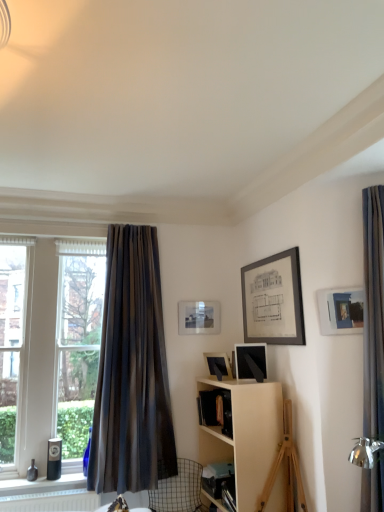
Question: Is dark gray textured curtain at left looking in the opposite direction of matte black picture frame at upper right, the second picture frame positioned from the right?

Choices:
 (A) no
 (B) yes

Answer: (A)

Question: Does dark gray textured curtain at left lie behind matte black picture frame at upper right, which ranks as the third picture frame in back-to-front order?

Choices:
 (A) yes
 (B) no

Answer: (A)

Question: Does dark gray textured curtain at left touch matte black picture frame at upper right, the second picture frame positioned from the right?

Choices:
 (A) no
 (B) yes

Answer: (A)

Question: Is dark gray textured curtain at left thinner than matte black picture frame at upper right, the second picture frame positioned from the right?

Choices:
 (A) no
 (B) yes

Answer: (A)

Question: From the image's perspective, is dark gray textured curtain at left under matte black picture frame at upper right, the 3th picture frame in the left-to-right sequence?

Choices:
 (A) no
 (B) yes

Answer: (A)

Question: Does dark gray textured curtain at left contain matte black picture frame at upper right, the second picture frame positioned from the right?

Choices:
 (A) yes
 (B) no

Answer: (B)

Question: Can you confirm if matte black picture frame at center, marked as the third picture frame in a right-to-left arrangement, is smaller than clear glass window at left?

Choices:
 (A) no
 (B) yes

Answer: (B)

Question: Does matte black picture frame at center, which is counted as the third picture frame, starting from the front, have a greater width compared to clear glass window at left?

Choices:
 (A) yes
 (B) no

Answer: (B)

Question: From the image's perspective, is matte black picture frame at center, which is the second picture frame from left to right, beneath clear glass window at left?

Choices:
 (A) yes
 (B) no

Answer: (A)

Question: Considering the relative sizes of matte black picture frame at center, which is the second picture frame from left to right, and clear glass window at left in the image provided, is matte black picture frame at center, which is the second picture frame from left to right, bigger than clear glass window at left?

Choices:
 (A) yes
 (B) no

Answer: (B)

Question: Can you confirm if matte black picture frame at center, the 2th picture frame in the back-to-front sequence, is positioned to the right of clear glass window at left?

Choices:
 (A) yes
 (B) no

Answer: (A)

Question: Is matte black picture frame at center, marked as the third picture frame in a right-to-left arrangement, thinner than clear glass window at left?

Choices:
 (A) yes
 (B) no

Answer: (A)

Question: Is dark gray textured curtain at left oriented away from matte white picture frame at upper right, which is the fourth picture frame from left to right?

Choices:
 (A) no
 (B) yes

Answer: (A)